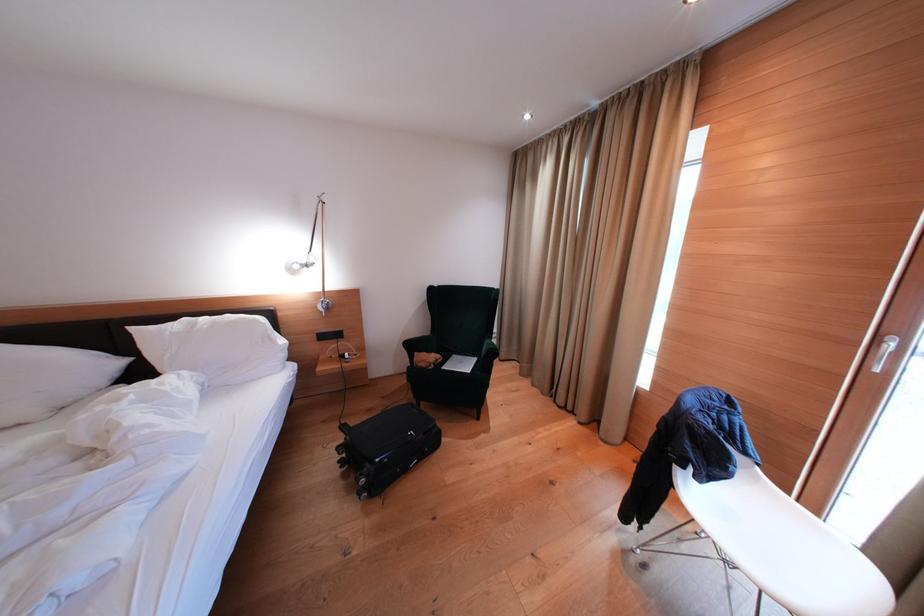
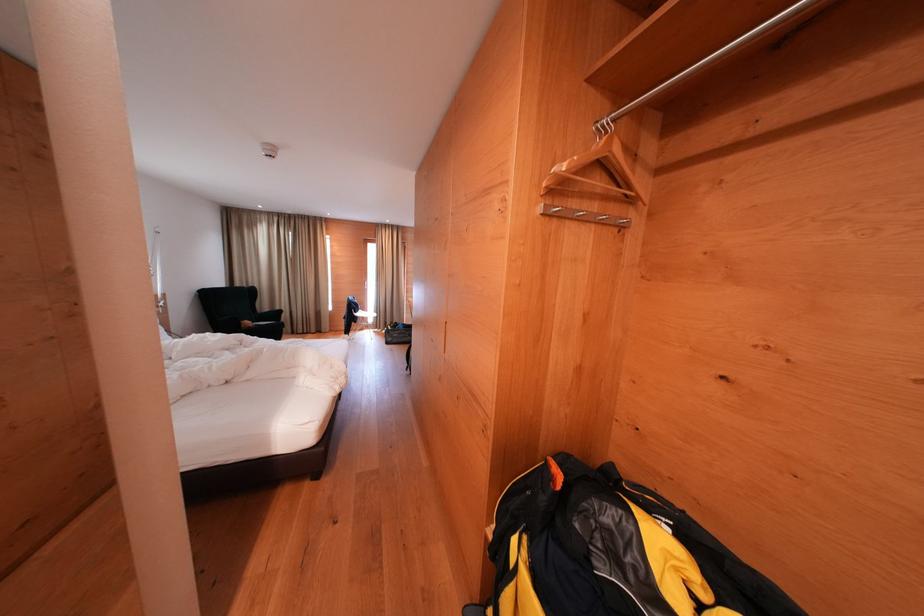
The point at [434,362] is marked in the first image. Where is the corresponding point in the second image?

(254, 328)